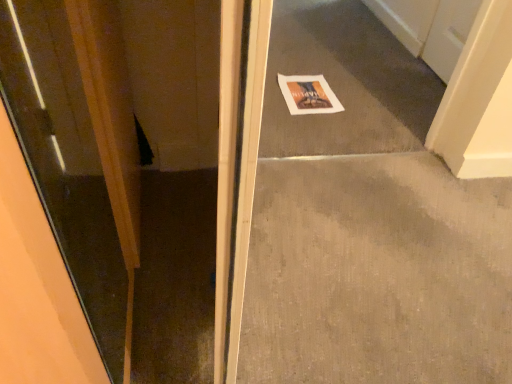
Question: Should I look upward or downward to see white paper at center?

Choices:
 (A) down
 (B) up

Answer: (B)